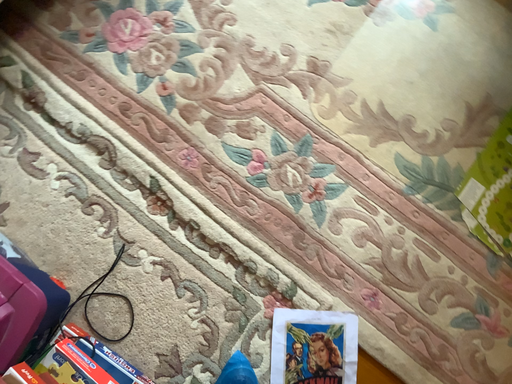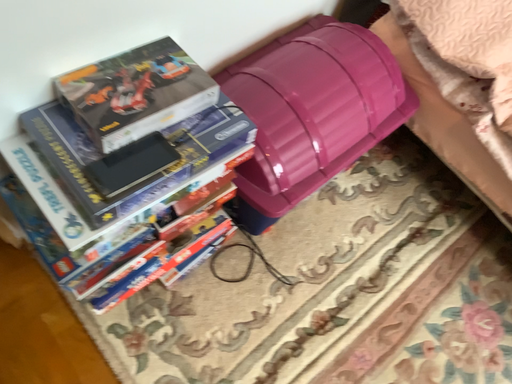
Question: Which way did the camera rotate in the video?

Choices:
 (A) rotated upward
 (B) rotated downward

Answer: (A)